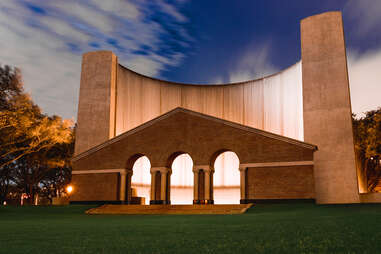
Where is `entryway`? entryway is located at coordinates (140, 184), (173, 176), (223, 179).